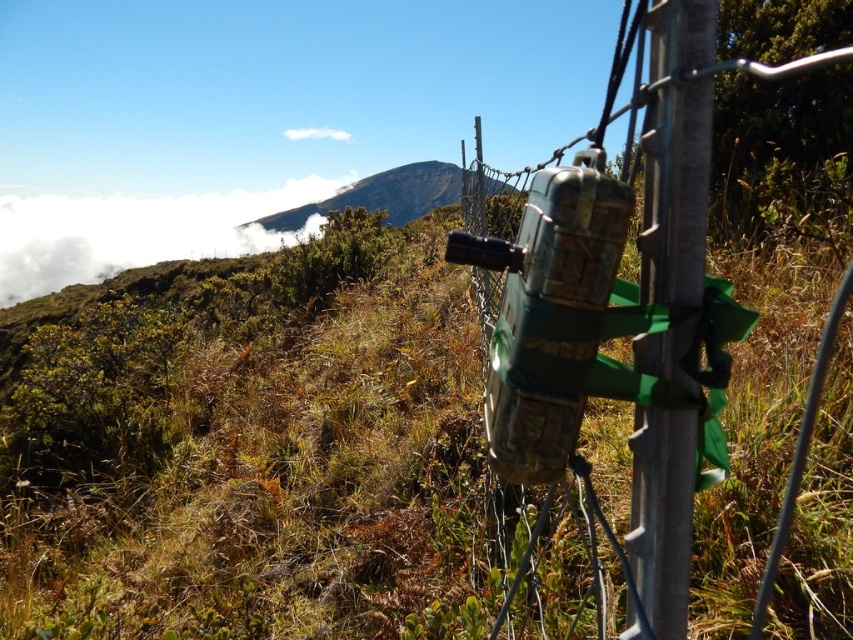
You are standing at the base of the mountain and want to place a 12 inch wide box between the metallic pole at right and the fence. Is there enough space?

The distance between the metallic pole at right and the fence is 25.12 inches. Since the box is 12 inches wide, there is sufficient space to place it between them.